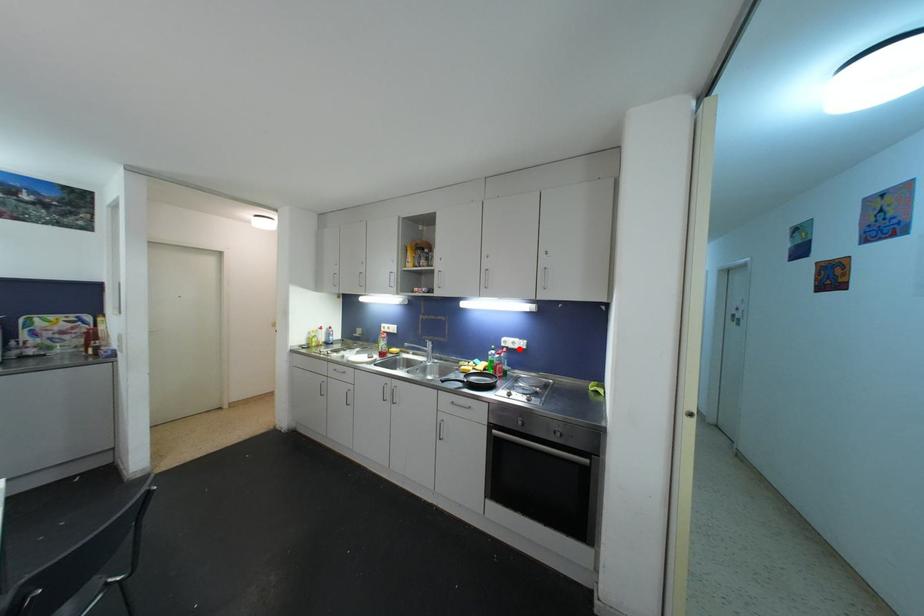
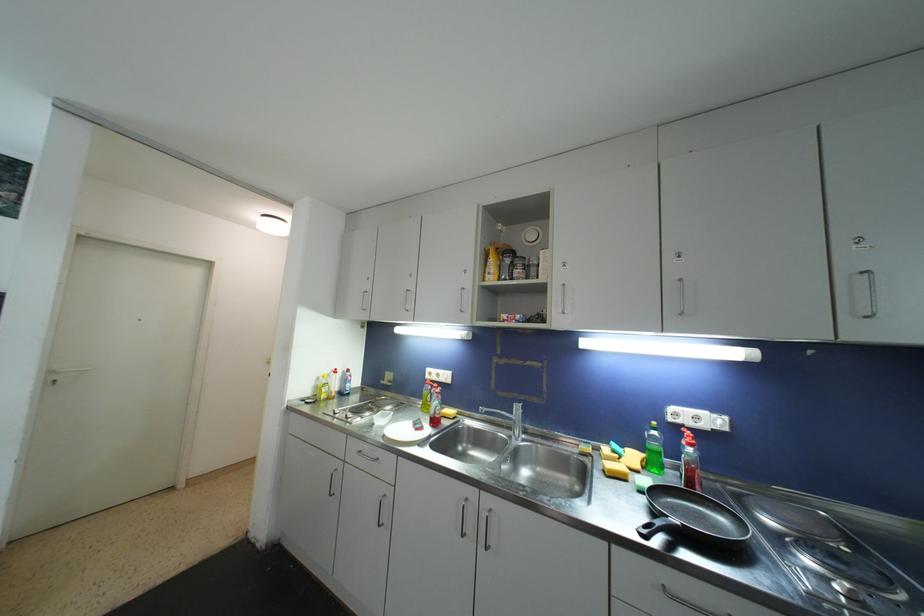
Where in the second image is the point corresponding to the highlighted location from the first image?

(708, 429)